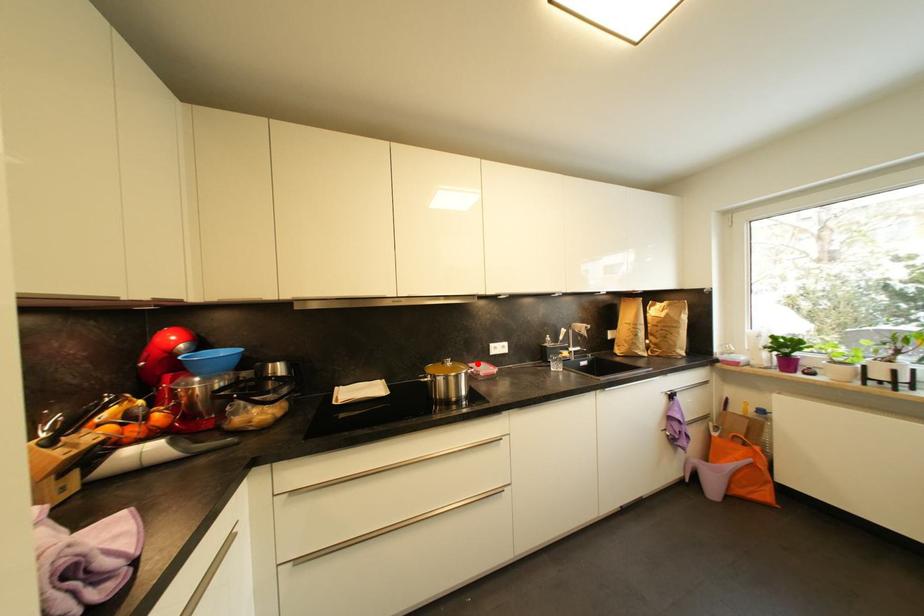
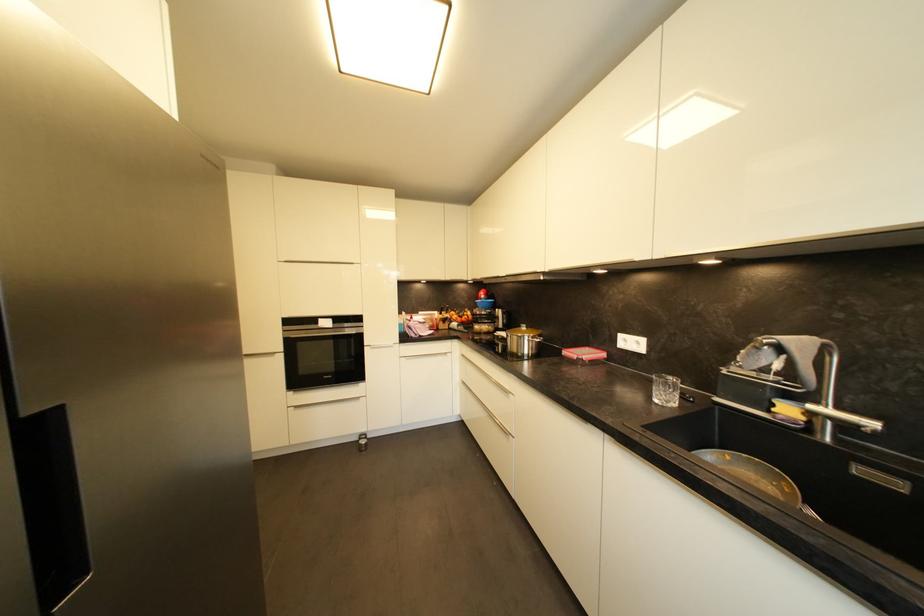
Question: I am providing you with two images of the same scene from different viewpoints. Image1 has a red point marked. In image2, the corresponding 3D location appears at what relative position? Reply with the corresponding letter.

Choices:
 (A) Closer
 (B) Farther

Answer: (A)